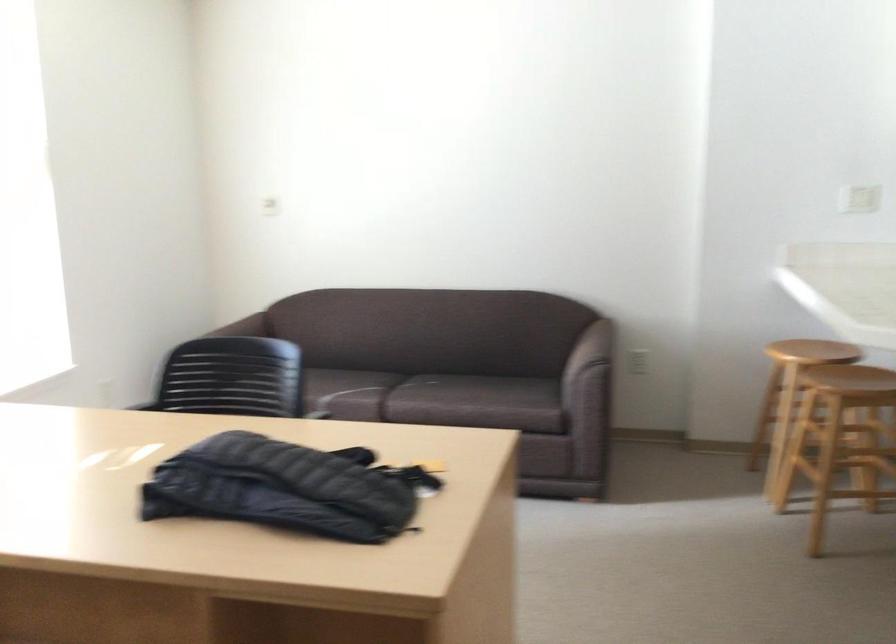
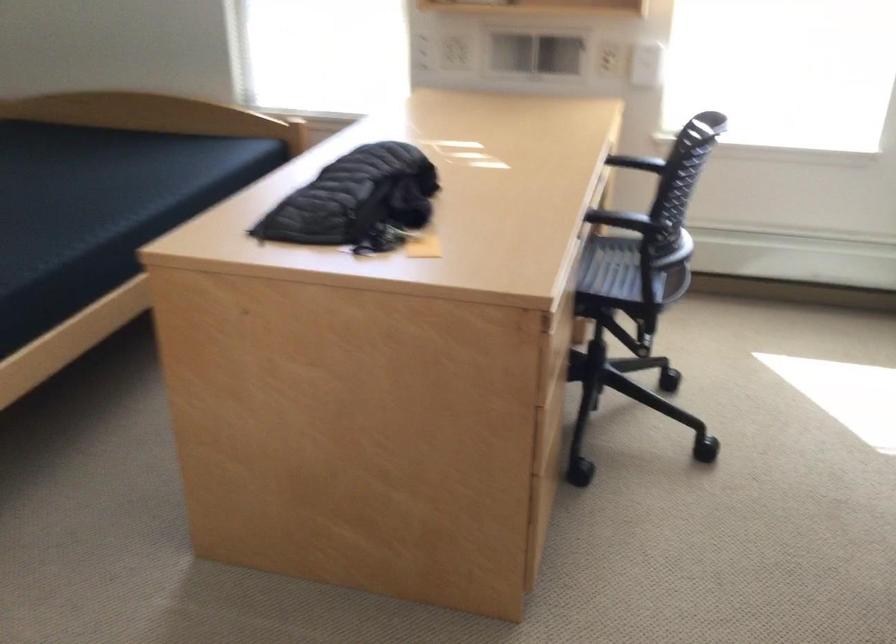
Where in the second image is the point corresponding to point 409,468 from the first image?

(421, 245)